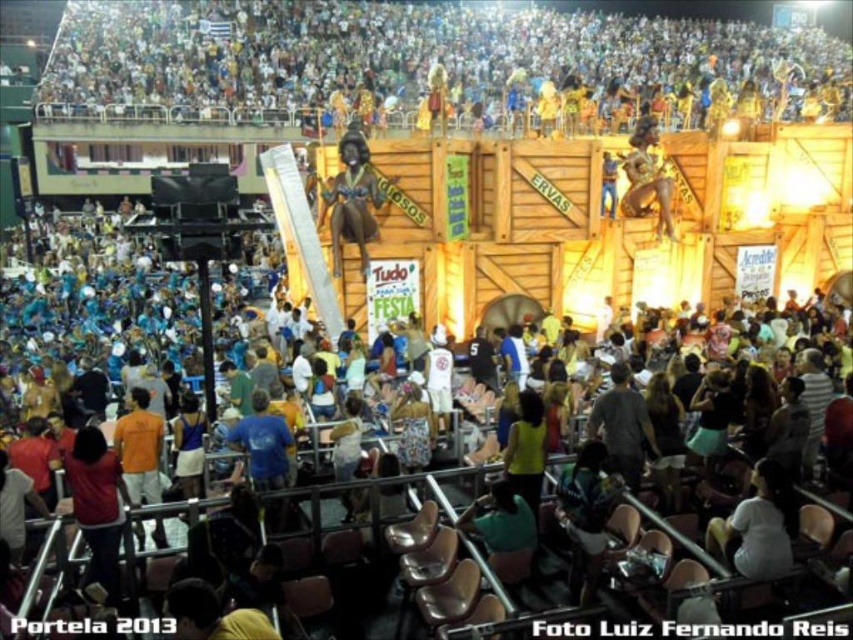
You are a photographer at the event and want to capture both the white matte shirt at lower right and the shiny gold statue at center in a single frame. Which object should you focus on first to ensure both are in the frame without moving the camera?

You should focus on the shiny gold statue at center first since it is larger than the white matte shirt at lower right, ensuring it fits within the frame while allowing the smaller shirt to also be captured.

You are an event organizer planning to place a new banner between the shiny gold statue at center and the green matte shirt at lower center. Considering their widths, which object should the banner be closer to to ensure it doesn

The shiny gold statue at center is wider than the green matte shirt at lower center, so the banner should be placed closer to the shiny gold statue at center to balance the width difference.